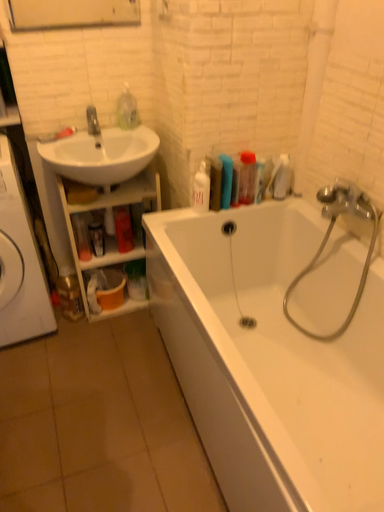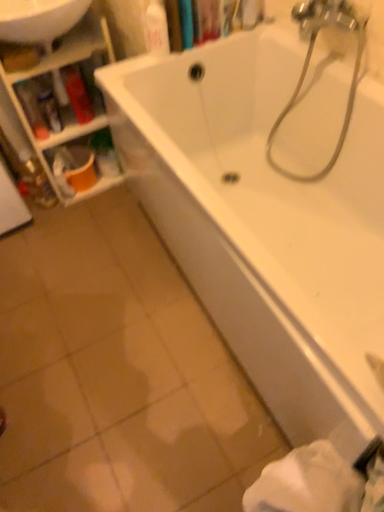
Question: Which way did the camera rotate in the video?

Choices:
 (A) rotated upward
 (B) rotated downward

Answer: (B)